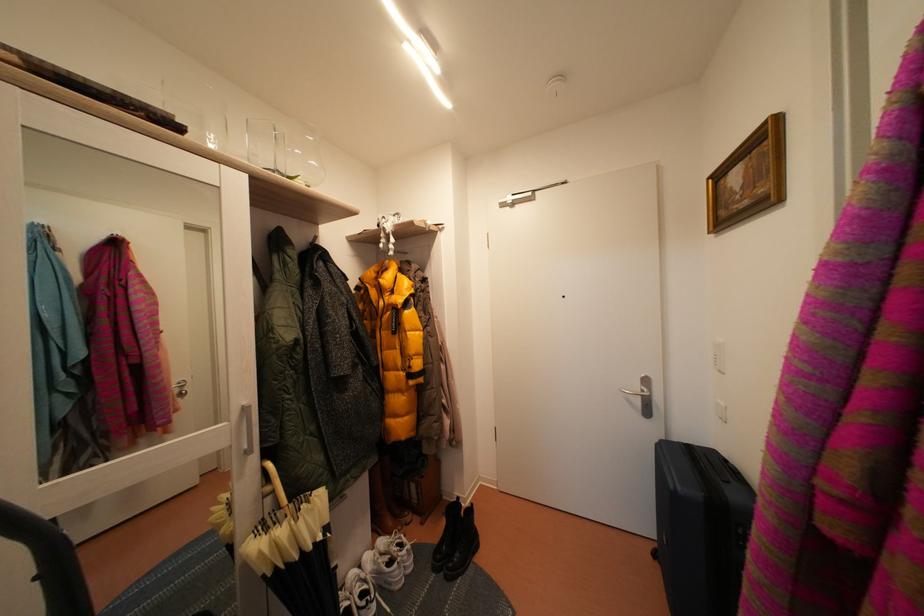
This screenshot has height=616, width=924. What do you see at coordinates (269, 492) in the screenshot?
I see `the wooden umbrella handle` at bounding box center [269, 492].